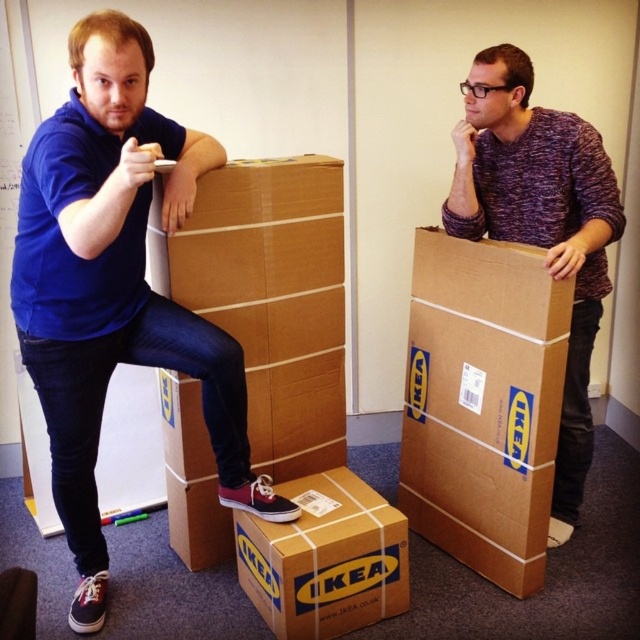
Question: Which object appears farthest from the camera in this image?

Choices:
 (A) purple knitted sweater at upper right
 (B) brown cardboard box at lower center
 (C) matte blue shirt at left

Answer: (B)

Question: Which object is closer to the camera taking this photo?

Choices:
 (A) brown cardboard box at right
 (B) matte blue shirt at left
 (C) purple knitted sweater at upper right
 (D) brown cardboard box at lower center

Answer: (B)

Question: Is purple knitted sweater at upper right thinner than brown cardboard box at lower center?

Choices:
 (A) yes
 (B) no

Answer: (A)

Question: Is matte blue shirt at left smaller than brown cardboard box at lower center?

Choices:
 (A) yes
 (B) no

Answer: (B)

Question: Which of the following is the closest to the observer?

Choices:
 (A) purple knitted sweater at upper right
 (B) brown cardboard box at lower center
 (C) brown cardboard box at right
 (D) matte blue shirt at left

Answer: (D)

Question: Considering the relative positions of matte blue shirt at left and purple knitted sweater at upper right in the image provided, where is matte blue shirt at left located with respect to purple knitted sweater at upper right?

Choices:
 (A) left
 (B) right

Answer: (A)